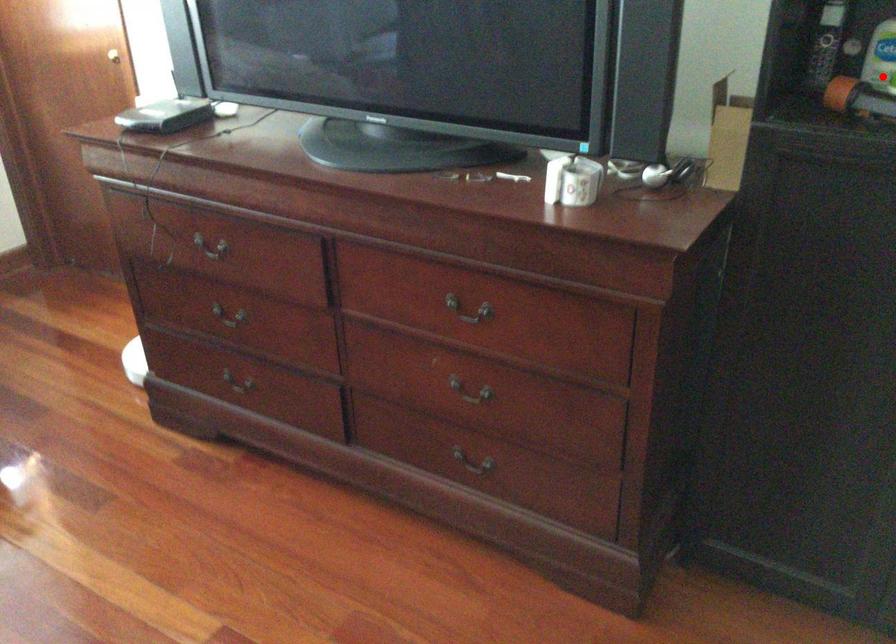
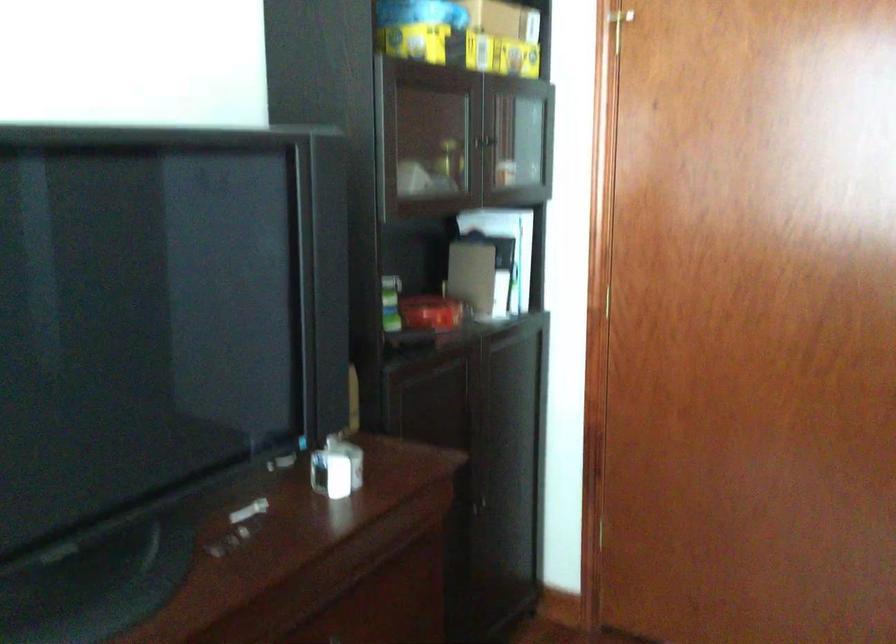
Question: I am providing you with two images of the same scene from different viewpoints. A red point is marked on the first image. At the location where the point appears in image 1, is it still visible in image 2?

Choices:
 (A) Yes
 (B) No

Answer: (B)